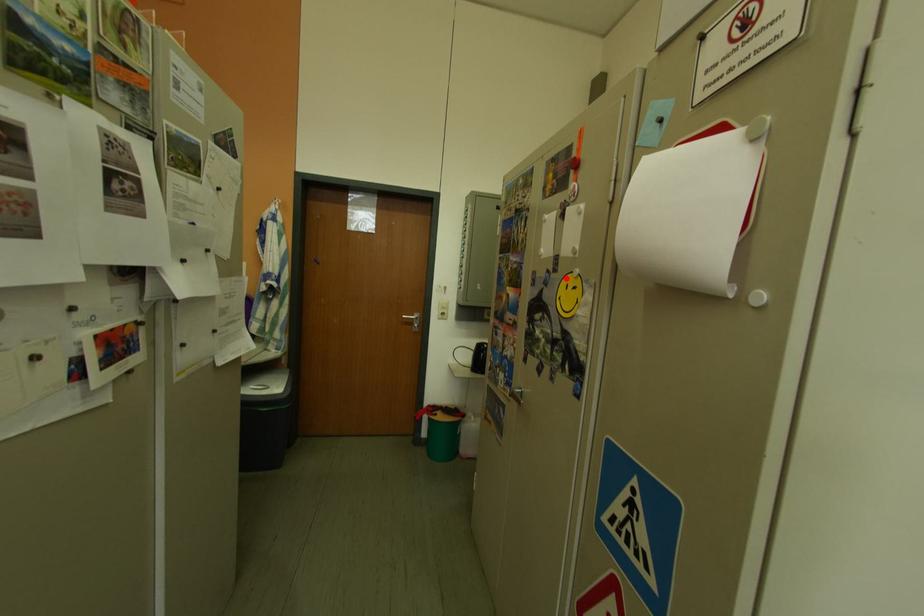
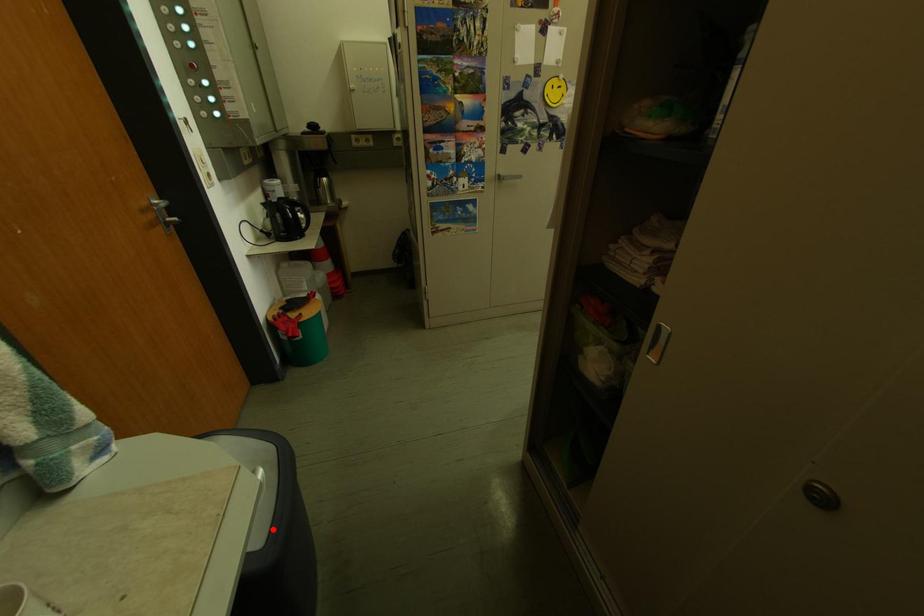
I am providing you with two images of the same scene from different viewpoints. A red point is marked on the first image and another point is marked on the second image. Are the points marked in image1 and image2 representing the same 3D position?

No